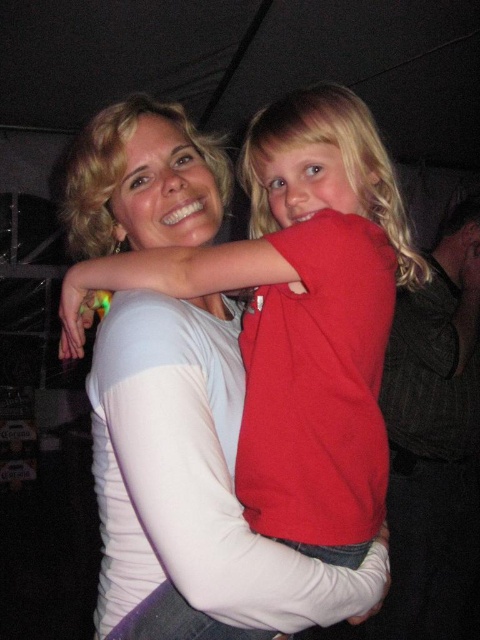
Who is shorter, red matte shirt at center or red cotton shirt at center?

red matte shirt at center is shorter.

Is point (301, 461) positioned behind point (463, 260)?

No, (301, 461) is closer to viewer.

Between point (294, 515) and point (452, 472), which one is positioned in front?

Positioned in front is point (294, 515).

The image size is (480, 640). Identify the location of red matte shirt at center. (299, 317).